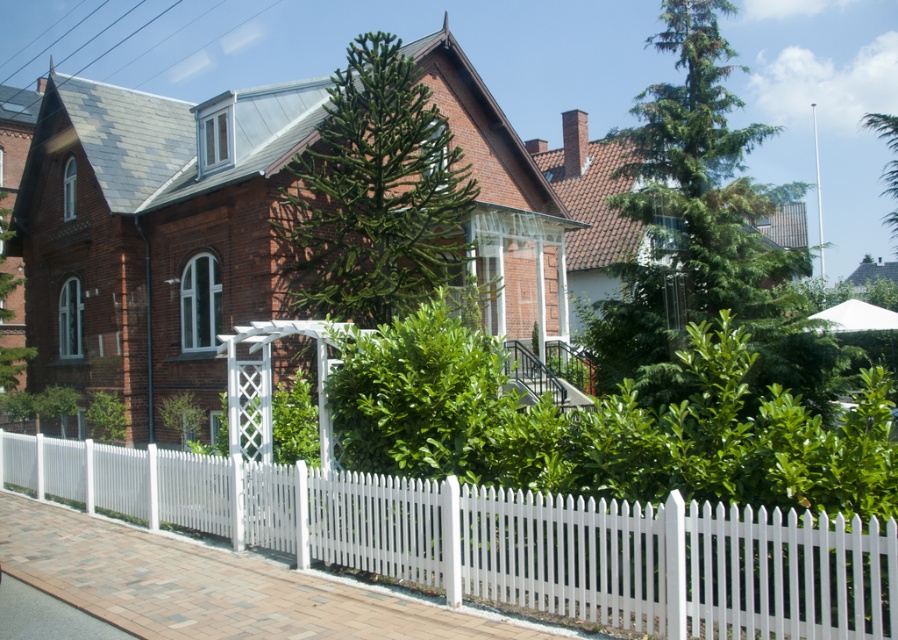
Question: Can you confirm if green needle-like at upper right is positioned to the right of green leafy tree at left?

Choices:
 (A) no
 (B) yes

Answer: (B)

Question: Based on their relative distances, which object is farther from the green needle-like at upper right?

Choices:
 (A) green leafy tree at center
 (B) white picket fence at lower center
 (C) green leafy tree at left

Answer: (C)

Question: Is white picket fence at lower center above green needle-like at upper right?

Choices:
 (A) yes
 (B) no

Answer: (B)

Question: Is green leafy tree at center further to camera compared to green leafy tree at left?

Choices:
 (A) yes
 (B) no

Answer: (B)

Question: Based on their relative distances, which object is nearer to the white picket fence at lower center?

Choices:
 (A) green leafy tree at left
 (B) green needle-like at upper right

Answer: (B)

Question: Based on their relative distances, which object is nearer to the green needle-like at upper right?

Choices:
 (A) white picket fence at lower center
 (B) green leafy tree at left

Answer: (A)